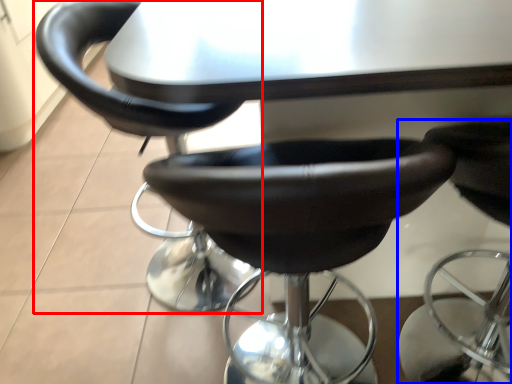
Question: Which object appears closest to the camera in this image, chair (highlighted by a red box) or chair (highlighted by a blue box)?

Choices:
 (A) chair
 (B) chair

Answer: (B)